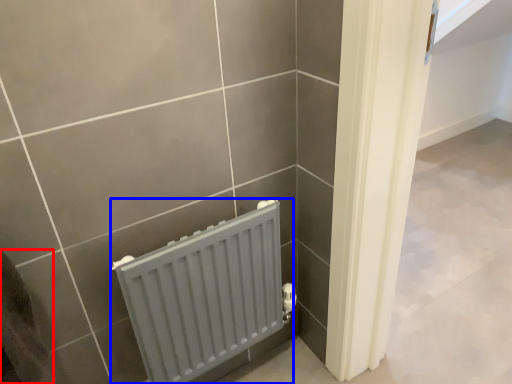
Question: Which of the following is the closest to the observer, gray (highlighted by a red box) or radiator (highlighted by a blue box)?

Choices:
 (A) gray
 (B) radiator

Answer: (A)